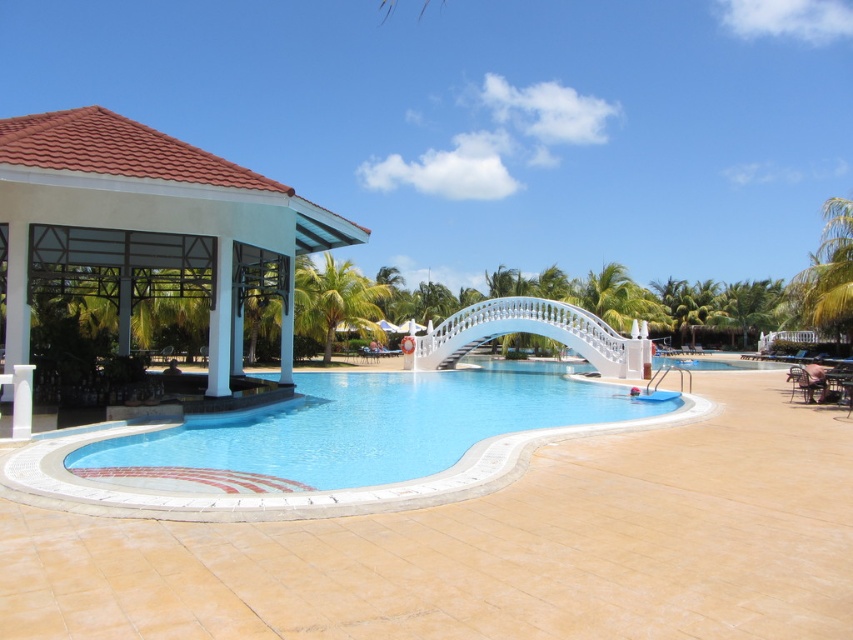
Based on the photo, you are standing at the edge of the swimming pool and want to place two decorative lights at the coordinates point (136,168) and point (334,308). Which light will appear closer to you when viewed from your current position?

The light placed at point (136,168) will appear closer to you because it is closer to the viewer compared to the other point.

You are standing at the point with coordinates (357, 429) in the image. What is the object you are standing on?

The point (357, 429) is on the blue glossy pool at center, so you are standing on the blue glossy pool at center.